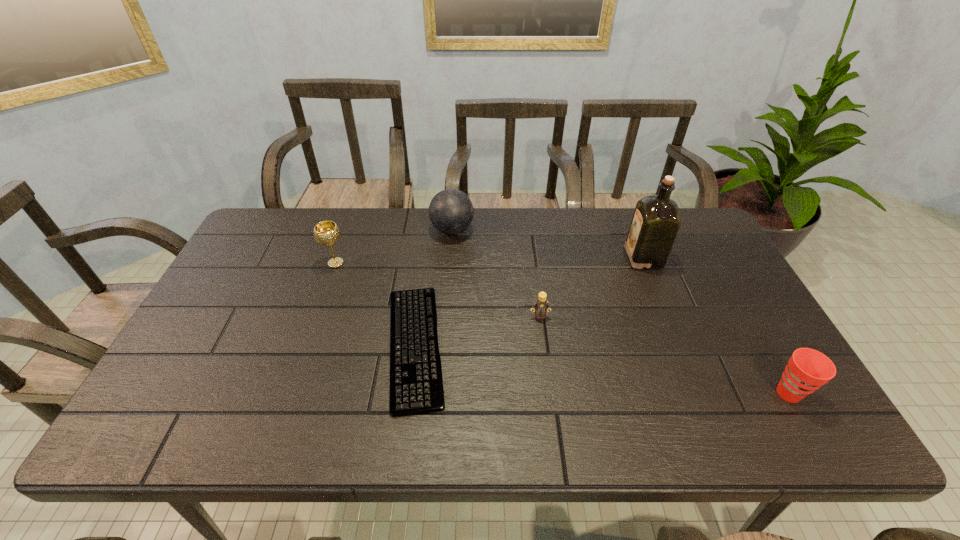
Where is `vacant space located 0.090m on the label of the liquor`? vacant space located 0.090m on the label of the liquor is located at coordinates (598, 258).

Locate an element on the screen. The image size is (960, 540). vacant area situated on the label of the liquor is located at coordinates (608, 258).

Image resolution: width=960 pixels, height=540 pixels. I want to click on free space located on the grip area of the bowling ball, so click(588, 230).

Image resolution: width=960 pixels, height=540 pixels. In order to click on vacant position located on the front of the chalice in this screenshot , I will do 312,331.

At what (x,y) coordinates should I click in order to perform the action: click on blank space located 0.380m on the back of the rightmost object. Please return your answer as a coordinate pair (x, y). This screenshot has width=960, height=540. Looking at the image, I should click on (718, 271).

Where is `free spot located in front of the Lego`? free spot located in front of the Lego is located at coordinates (546, 366).

At what (x,y) coordinates should I click in order to perform the action: click on blank space located on the left of the computer keyboard. Please return your answer as a coordinate pair (x, y). The height and width of the screenshot is (540, 960). Looking at the image, I should click on (249, 346).

Locate an element on the screen. liquor situated at the far edge is located at coordinates click(x=656, y=220).

The width and height of the screenshot is (960, 540). Identify the location of bowling ball that is at the far edge. (451, 211).

Where is `cup that is positioned at the near edge`? This screenshot has width=960, height=540. cup that is positioned at the near edge is located at coordinates [807, 370].